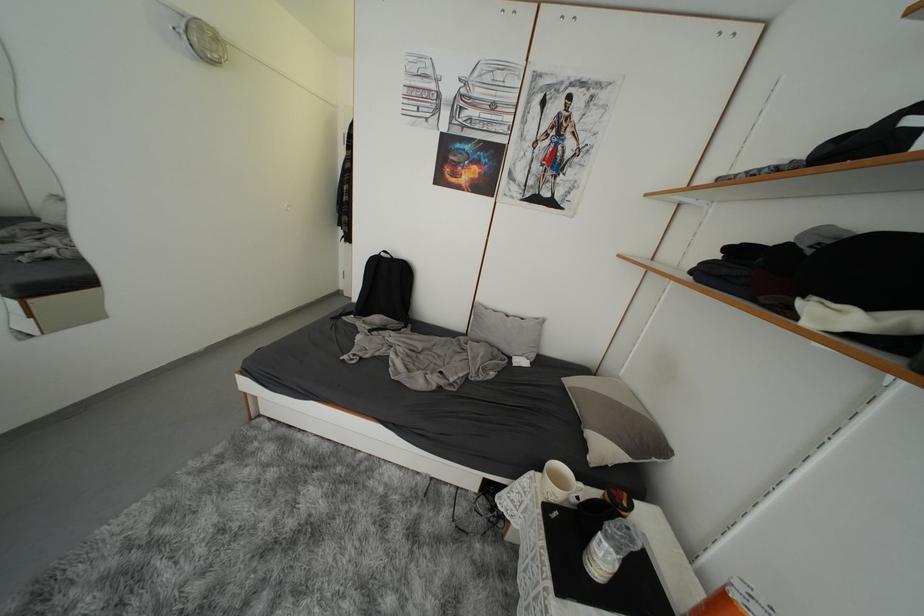
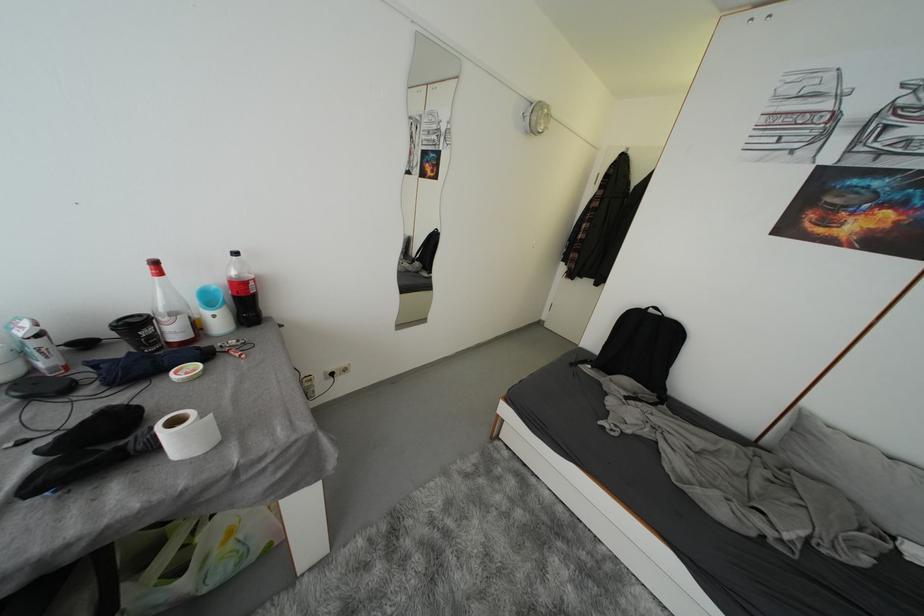
Where in the second image is the point corresponding to point (390, 257) from the first image?

(658, 314)